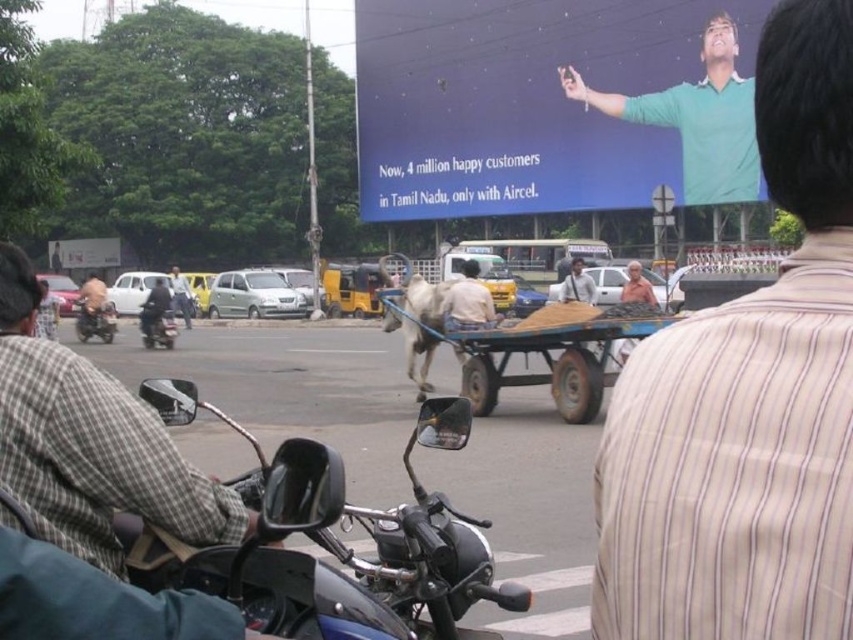
Is point (770, 467) more distant than point (86, 316)?

No, it is in front of (86, 316).

Does green cotton shirt at upper right appear under light brown leather jacket at left?

Correct, green cotton shirt at upper right is located below light brown leather jacket at left.

Is point (733, 404) less distant than point (79, 312)?

Yes, it is.

Where is `green cotton shirt at upper right`? The width and height of the screenshot is (853, 640). green cotton shirt at upper right is located at coordinates click(747, 400).

Can you confirm if blue matte billboard at upper center is taller than dark blue shirt at left?

Correct, blue matte billboard at upper center is much taller as dark blue shirt at left.

Which of these two, blue matte billboard at upper center or dark blue shirt at left, stands shorter?

Standing shorter between the two is dark blue shirt at left.

Which is behind, point (668, 10) or point (160, 282)?

Point (668, 10)

Where is `blue matte billboard at upper center`? The height and width of the screenshot is (640, 853). blue matte billboard at upper center is located at coordinates (552, 104).

Identify the location of blue matte billboard at upper center. This screenshot has height=640, width=853. (552, 104).

Between blue matte billboard at upper center and light blue shirt at center, which one appears on the left side from the viewer's perspective?

light blue shirt at center is more to the left.

Which is in front, point (538, 19) or point (180, 289)?

Point (180, 289)

Find the location of a particular element. This screenshot has width=853, height=640. blue matte billboard at upper center is located at coordinates (552, 104).